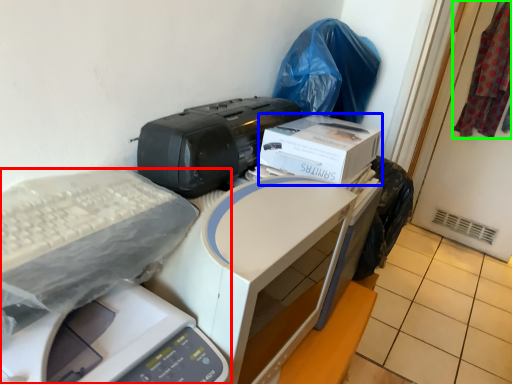
Question: Estimate the real-world distances between objects in this image. Which object is closer to printer (highlighted by a red box), box (highlighted by a blue box) or material (highlighted by a green box)?

Choices:
 (A) box
 (B) material

Answer: (A)